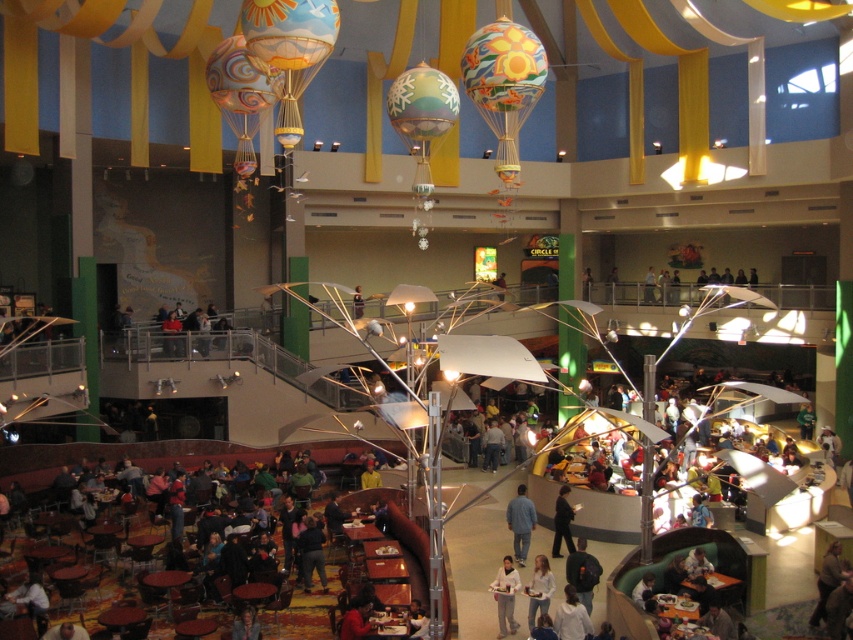
Can you confirm if green matte balloon at center is positioned above dark blue shirt at center?

Indeed, green matte balloon at center is positioned over dark blue shirt at center.

Is point (421, 64) positioned behind point (318, 552)?

Yes, it is.

The image size is (853, 640). In order to click on green matte balloon at center in this screenshot , I will do `click(422, 104)`.

Who is more distant from viewer, [582,584] or [315,532]?

Positioned behind is point [315,532].

Which of these two, dark blue backpack at center or dark blue shirt at center, stands shorter?

Standing shorter between the two is dark blue backpack at center.

What do you see at coordinates (582, 572) in the screenshot? I see `dark blue backpack at center` at bounding box center [582, 572].

You are a GUI agent. You are given a task and a screenshot of the screen. Output one action in this format:
    pyautogui.click(x=<x>, y=<y>)
    Task: Click on the dark blue backpack at center
    This screenshot has height=640, width=853.
    Given the screenshot: What is the action you would take?
    pyautogui.click(x=582, y=572)

Does multicolored glossy balloon at upper center have a lesser height compared to dark blue shirt at center?

No, multicolored glossy balloon at upper center is not shorter than dark blue shirt at center.

Is multicolored glossy balloon at upper center below dark blue shirt at center?

No.

Image resolution: width=853 pixels, height=640 pixels. What are the coordinates of `multicolored glossy balloon at upper center` in the screenshot? It's located at pyautogui.click(x=503, y=67).

Identify the location of multicolored glossy balloon at upper center. (503, 67).